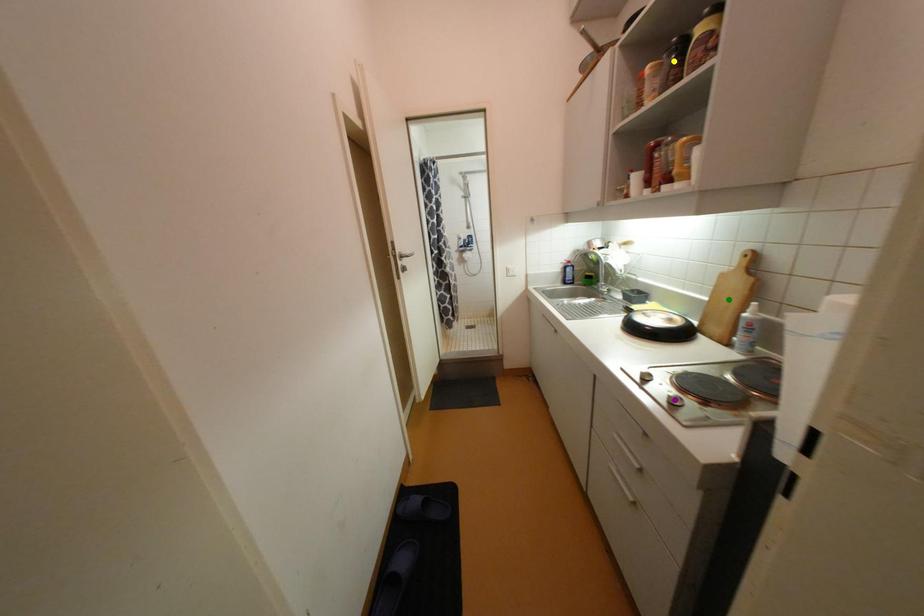
Order these from nearest to farthest:
purple point
green point
yellow point

1. purple point
2. yellow point
3. green point